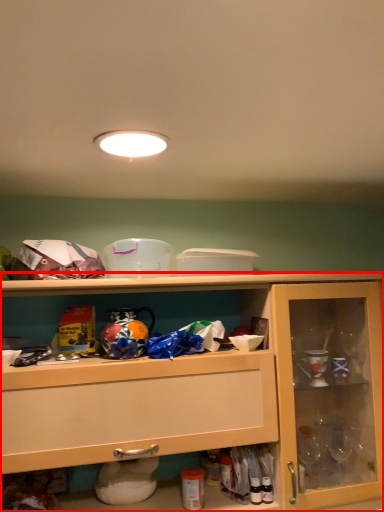
Question: From the image's perspective, where is cabinetry (annotated by the red box) located in relation to lighting in the image?

Choices:
 (A) below
 (B) above

Answer: (A)